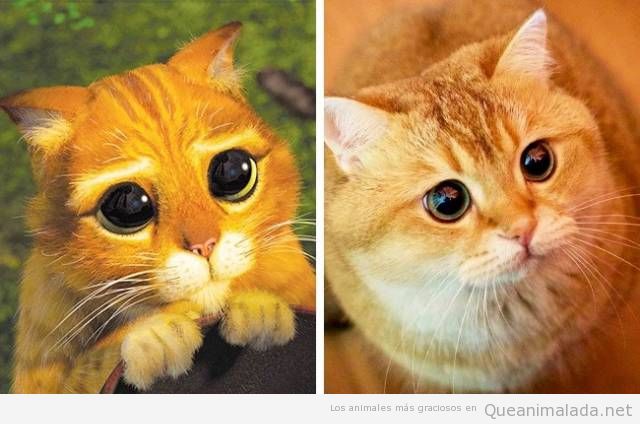
The width and height of the screenshot is (640, 424). In order to click on pictures in this screenshot , I will do `click(244, 34)`, `click(368, 34)`.